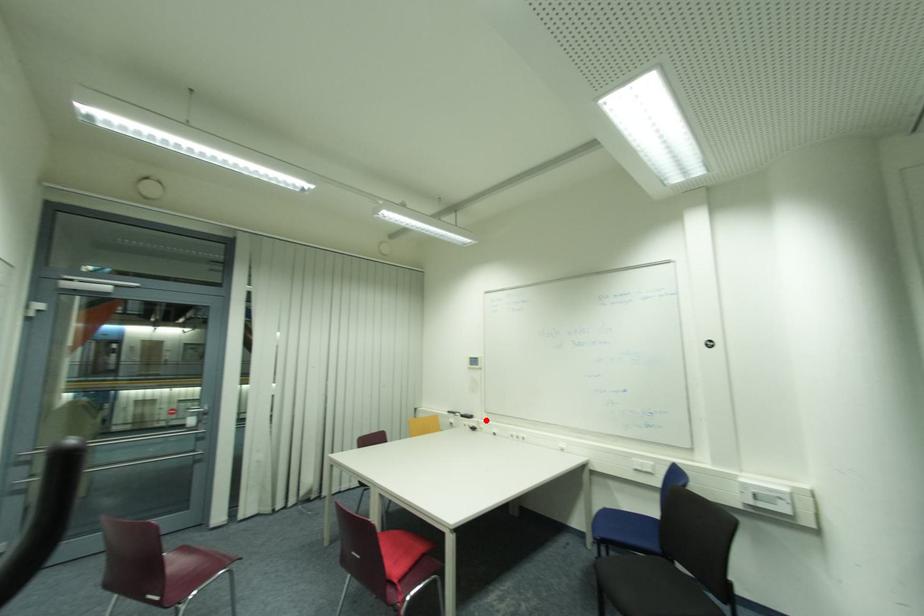
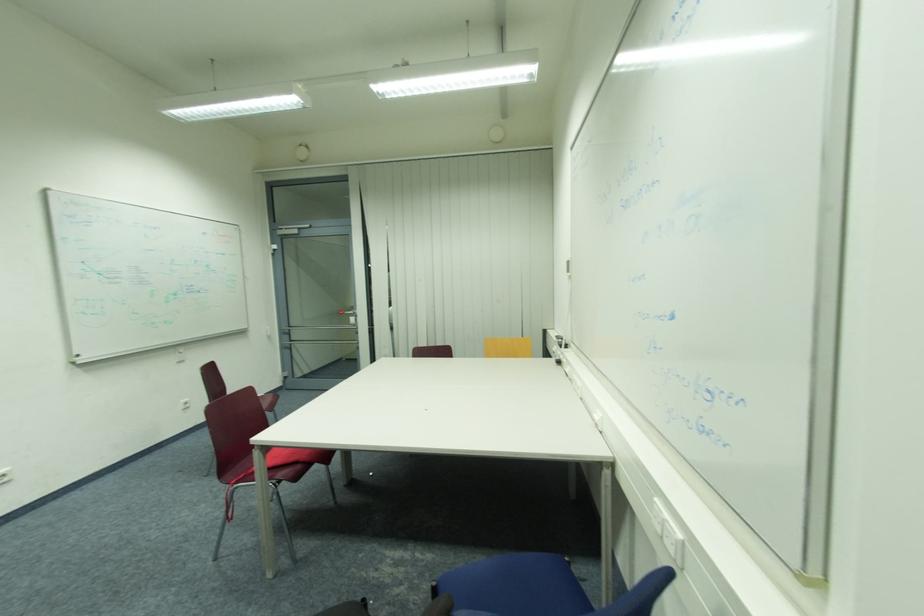
Question: I am providing you with two images of the same scene from different viewpoints. Image1 has a red point marked. In image2, the corresponding 3D location appears at what relative position? Reply with the corresponding letter.

Choices:
 (A) Closer
 (B) Farther

Answer: (A)